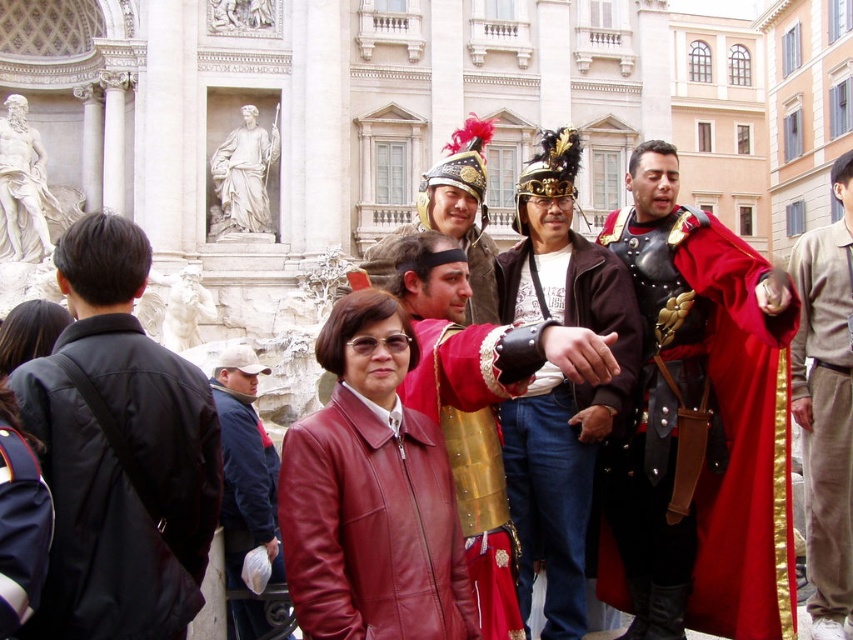
Which is behind, point (753, 352) or point (258, 508)?

Point (258, 508)

Based on the photo, which is more to the left, shiny black armor at center or blue fleece jacket at center?

Positioned to the left is blue fleece jacket at center.

Is point (718, 577) positioned before point (241, 353)?

Yes, it is.

The width and height of the screenshot is (853, 640). Identify the location of shiny black armor at center. (701, 424).

Measure the distance between point (49, 406) and camera.

26.65 meters

Does point (100, 538) come closer to viewer compared to point (241, 634)?

That is True.

Between point (96, 458) and point (225, 508), which one is positioned behind?

Point (225, 508)

This screenshot has width=853, height=640. In order to click on black leather jacket at left in this screenshot , I will do `click(119, 452)`.

Is shiny black armor at center to the left of red velvet cape at center from the viewer's perspective?

Yes, shiny black armor at center is to the left of red velvet cape at center.

Does shiny black armor at center have a lesser width compared to red velvet cape at center?

Correct, shiny black armor at center's width is less than red velvet cape at center's.

Is point (660, 180) positioned behind point (805, 323)?

That is False.

This screenshot has height=640, width=853. What are the coordinates of `shiny black armor at center` in the screenshot? It's located at (701, 424).